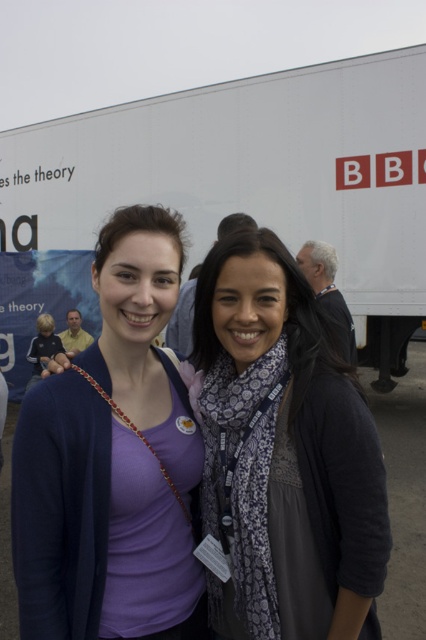
You are a photographer trying to capture a photo of the matte purple shirt at center and the white matte trailer truck at upper center. Based on their positions, which object should you focus on first to ensure both are in frame?

The white matte trailer truck at upper center is positioned on the right side of the matte purple shirt at center, so you should focus on the matte purple shirt at center first to ensure both are in frame.

You are a photographer trying to capture a closeup of the matte purple shirt at center and the patterned scarf at center. Which item should you zoom in on more to ensure both are in focus?

The matte purple shirt at center is smaller than the patterned scarf at center, so you should zoom in more on the matte purple shirt at center to ensure both are in focus.